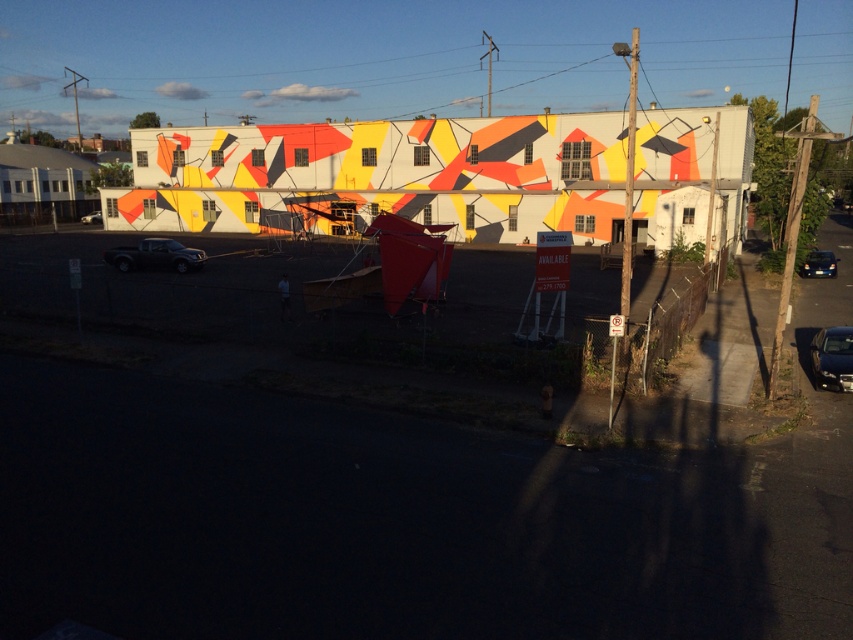
Does matte black truck at lower left have a smaller size compared to black matte car at lower right?

No.

Which is in front, point (169, 262) or point (820, 259)?

Point (169, 262) is more forward.

Who is more forward, (184, 262) or (799, 266)?

Point (184, 262) is in front.

Locate an element on the screen. Image resolution: width=853 pixels, height=640 pixels. matte black truck at lower left is located at coordinates (155, 256).

Does point (802, 273) come in front of point (94, 221)?

Yes, it is in front of point (94, 221).

What do you see at coordinates (817, 262) in the screenshot? The width and height of the screenshot is (853, 640). I see `black matte car at lower right` at bounding box center [817, 262].

Is point (810, 264) closer to camera compared to point (97, 221)?

Yes.

Where is `black matte car at lower right`? The height and width of the screenshot is (640, 853). black matte car at lower right is located at coordinates (817, 262).

Which is above, metallic blue sedan at lower right or black matte car at lower right?

black matte car at lower right is higher up.

Does metallic blue sedan at lower right have a smaller size compared to black matte car at lower right?

Incorrect, metallic blue sedan at lower right is not smaller in size than black matte car at lower right.

Who is more forward, (846, 360) or (831, 262)?

Point (846, 360)

Locate an element on the screen. This screenshot has height=640, width=853. metallic blue sedan at lower right is located at coordinates (833, 356).